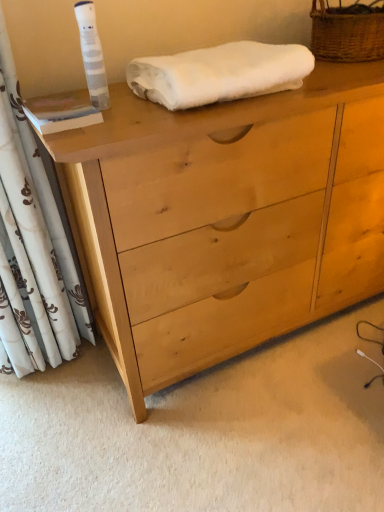
This screenshot has height=512, width=384. What are the coordinates of `spots to the right of white fluffy towel at upper center` in the screenshot? It's located at (336, 76).